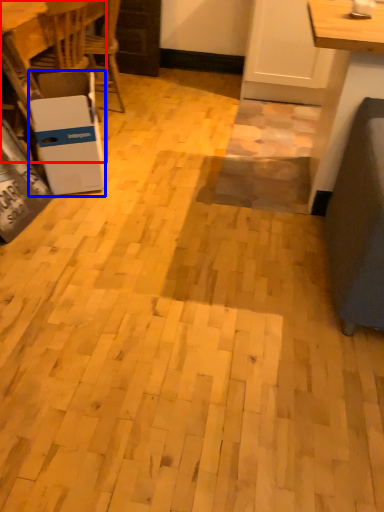
Question: Which object appears closest to the camera in this image, table (highlighted by a red box) or cardboard box (highlighted by a blue box)?

Choices:
 (A) table
 (B) cardboard box

Answer: (B)